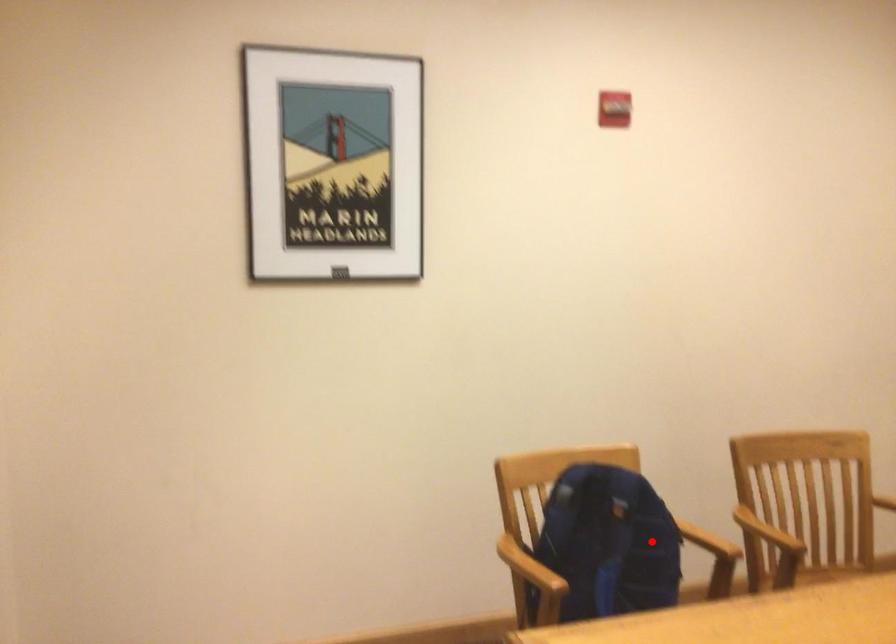
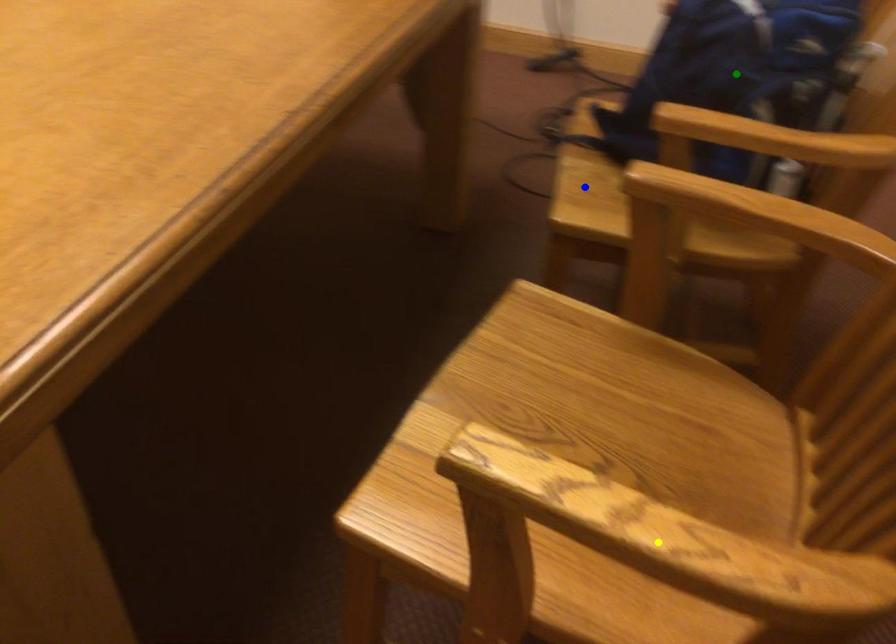
Question: I am providing you with two images of the same scene from different viewpoints. A red point is marked on the first image. You are given multiple points on the second image. Which point in image 2 is actually the same real-world point as the red point in image 1?

Choices:
 (A) yellow point
 (B) green point
 (C) blue point

Answer: (B)